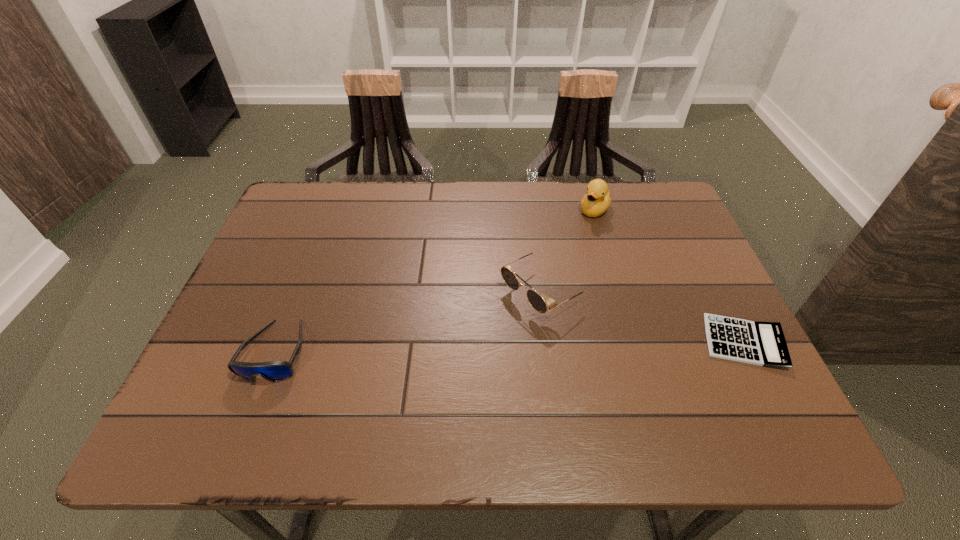
Where is `the second shortest object`? The width and height of the screenshot is (960, 540). the second shortest object is located at coordinates click(274, 371).

The height and width of the screenshot is (540, 960). Identify the location of the leftmost object. pos(274,371).

Locate an element on the screen. This screenshot has width=960, height=540. the rightmost object is located at coordinates (763, 344).

In order to click on calculator in this screenshot , I will do `click(763, 344)`.

Where is `the tallest object`? the tallest object is located at coordinates (596, 201).

This screenshot has height=540, width=960. What are the coordinates of `the farthest object` in the screenshot? It's located at pos(596,201).

In order to click on the third object from right to left in this screenshot , I will do `click(536, 301)`.

Locate an element on the screen. The width and height of the screenshot is (960, 540). the second tallest object is located at coordinates 536,301.

Find the location of a particular element. vacant area situated on the back of the shortest object is located at coordinates (684, 226).

Find the location of a particular element. free space located 0.200m facing forward on the farthest object is located at coordinates (560, 262).